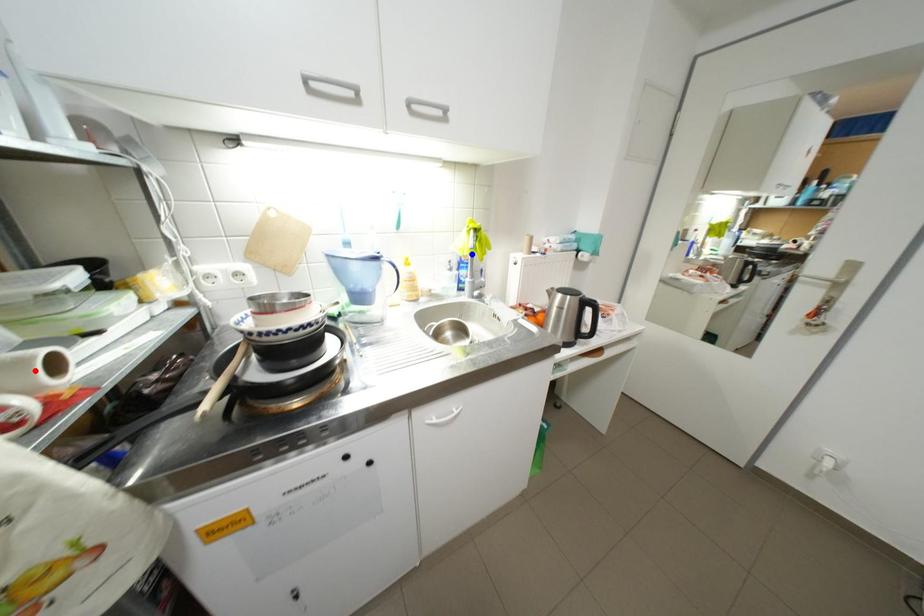
Question: In the image, two points are highlighted. Which point is nearer to the camera? Reply with the corresponding letter.

Choices:
 (A) blue point
 (B) red point

Answer: (B)